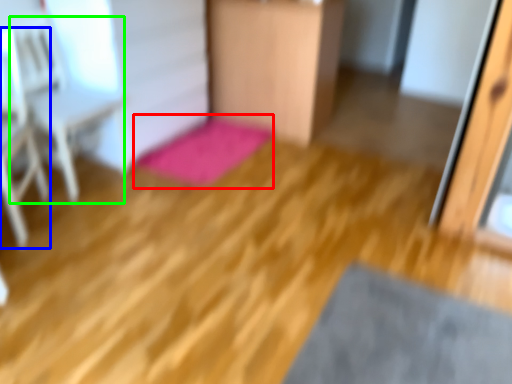
Question: Based on their relative distances, which object is farther from bath mat (highlighted by a red box)? Choose from armchair (highlighted by a blue box) and armchair (highlighted by a green box).

Choices:
 (A) armchair
 (B) armchair

Answer: (A)